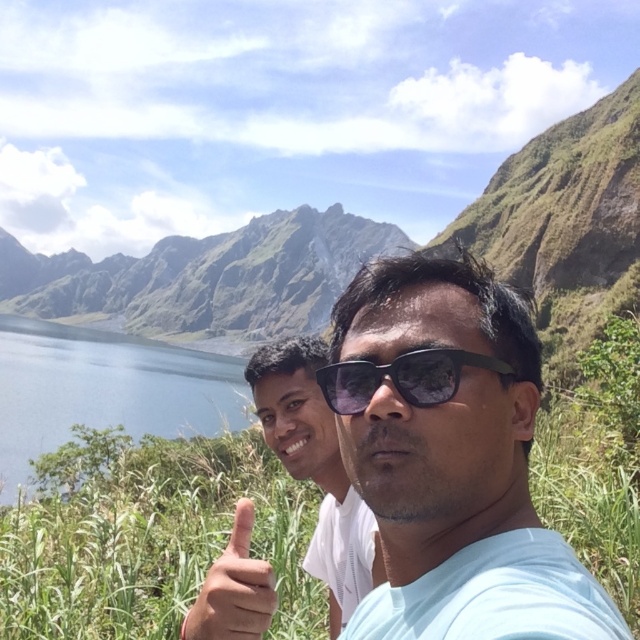
Looking at this image, you are a photographer trying to capture the light skin tone flesh at center and the blue glassy water at left in the same frame. Based on their positions, which object is closer to the camera?

The blue glassy water at left is closer to the camera since the light skin tone flesh at center is positioned behind it.

You are standing at point [230,598] and want to walk to point [45,396]. Which direction should you move in relation to the two people in the image?

Point [45,396] is behind point [230,598], so you should move backward in the direction away from the two people to reach it.